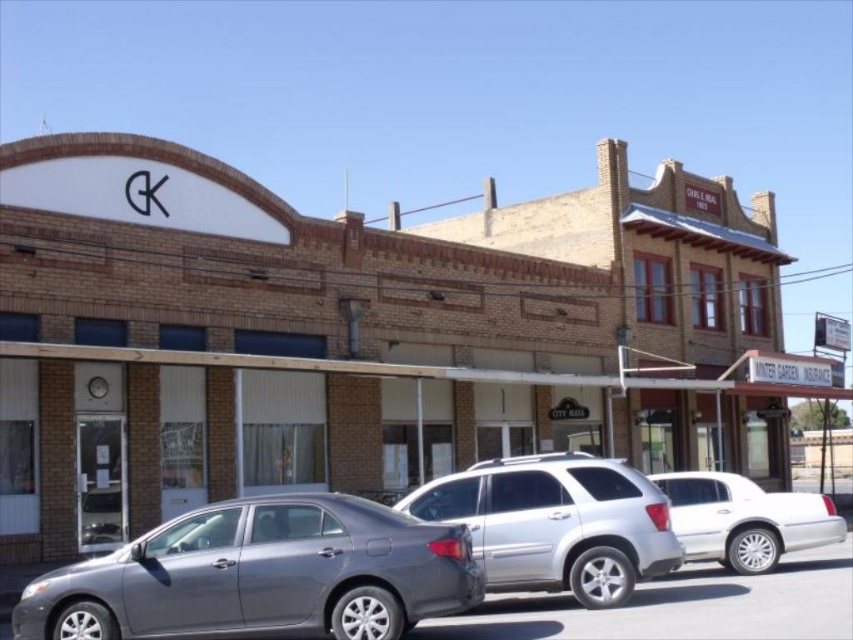
You are a delivery person who needs to park your van between the silver metallic suv at center and the white metallic sedan at right. Is there enough space between them for your van?

The silver metallic suv at center is above the white metallic sedan at right, meaning they are parked in different rows. Therefore, there is no space between them for your van to park.

You are a delivery driver who needs to park your truck between the satin silver sedan at center and the silver metallic suv at center. Can you fit your truck which is 2 meters wide between them?

The satin silver sedan at center is positioned on the left side of silver metallic suv at center. The distance between them is not specified, so it is uncertain whether the truck can fit. Please check the actual space available.

Consider the image. You are a delivery person trying to park your van, which is 1.8 meters tall, in the space between the satin silver sedan at center and the white metallic sedan at right. Can your van fit vertically between them?

The satin silver sedan at center is not as tall as white metallic sedan at right. Since the tallest vehicle between them is the white metallic sedan at right, and the height of the satin silver sedan at center is not specified, it is uncertain whether the van can fit. Please check the height of the tallest vehicle before deciding.